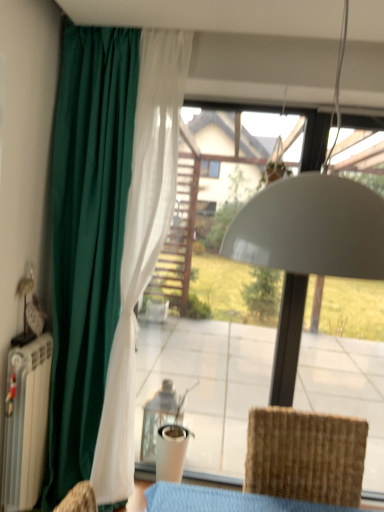
Question: Looking at their shapes, would you say green fabric curtain at left is wider or thinner than woven brown chair at lower right?

Choices:
 (A) wide
 (B) thin

Answer: (B)

Question: Would you say green fabric curtain at left is inside or outside woven brown chair at lower right?

Choices:
 (A) outside
 (B) inside

Answer: (A)

Question: From the image's perspective, relative to woven brown chair at lower right, is green fabric curtain at left above or below?

Choices:
 (A) below
 (B) above

Answer: (B)

Question: Does point pos(332,500) appear closer or farther from the camera than point pos(94,83)?

Choices:
 (A) closer
 (B) farther

Answer: (A)

Question: From a real-world perspective, is woven brown chair at lower right above or below green fabric curtain at left?

Choices:
 (A) below
 (B) above

Answer: (A)

Question: Is woven brown chair at lower right taller or shorter than green fabric curtain at left?

Choices:
 (A) tall
 (B) short

Answer: (B)

Question: Considering the positions of woven brown chair at lower right and green fabric curtain at left in the image, is woven brown chair at lower right wider or thinner than green fabric curtain at left?

Choices:
 (A) thin
 (B) wide

Answer: (B)